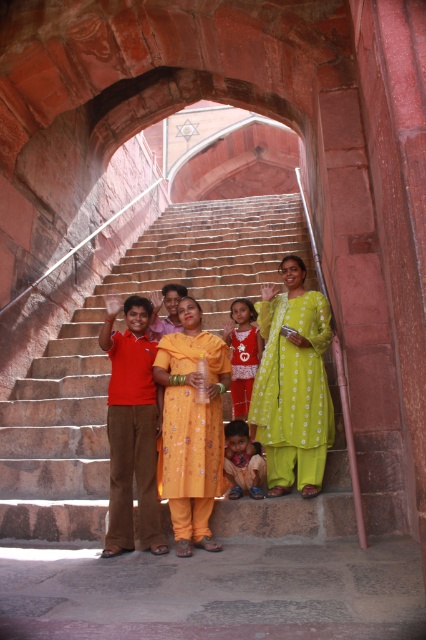
Who is positioned more to the right, yellow cotton dress at center or yellow embroidered dress at center?

Positioned to the right is yellow cotton dress at center.

Is point (290, 337) closer to camera compared to point (187, 308)?

Yes, it is.

Identify the location of yellow cotton dress at center. (293, 381).

Between point (310, 424) and point (307, 358), which one is positioned in front?

Point (310, 424) is more forward.

Which is behind, point (166, 483) or point (322, 388)?

Positioned behind is point (322, 388).

I want to click on yellow cotton dress at center, so click(x=293, y=381).

Is yellow cotton dress at center behind matte pink dress at center?

No, it is in front of matte pink dress at center.

Does yellow cotton dress at center appear under matte pink dress at center?

Correct, yellow cotton dress at center is located below matte pink dress at center.

Is point (183, 394) closer to camera compared to point (255, 365)?

Yes.

This screenshot has width=426, height=640. I want to click on yellow cotton dress at center, so coord(293,381).